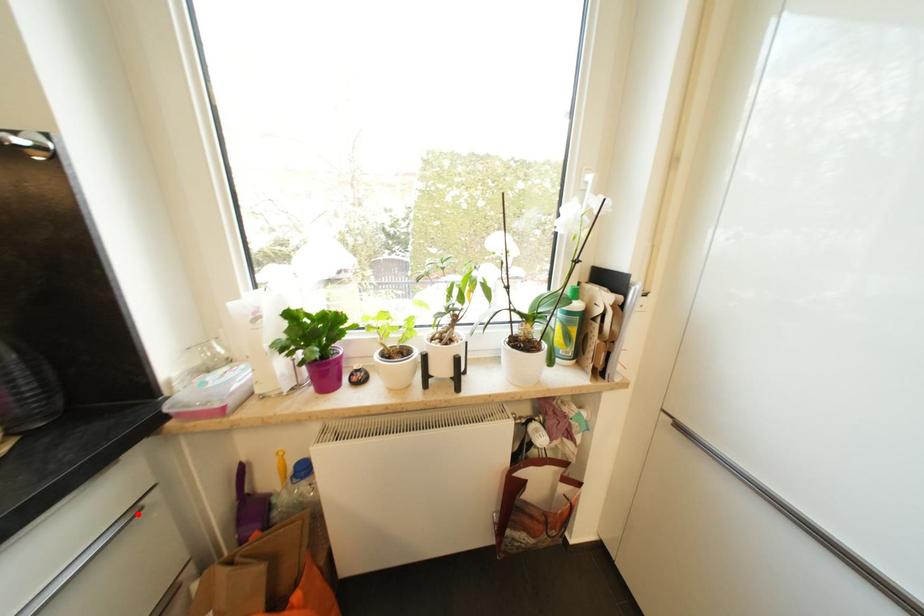
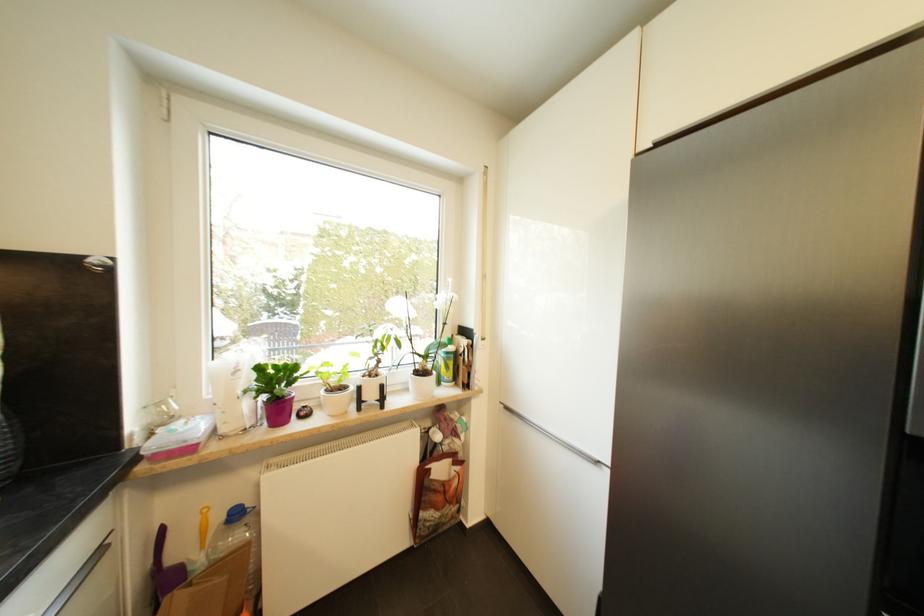
Question: A red point is marked in image1. In image2, is the corresponding 3D point closer to the camera or farther? Reply with the corresponding letter.

Choices:
 (A) The corresponding 3D point is closer.
 (B) The corresponding 3D point is farther.

Answer: (B)